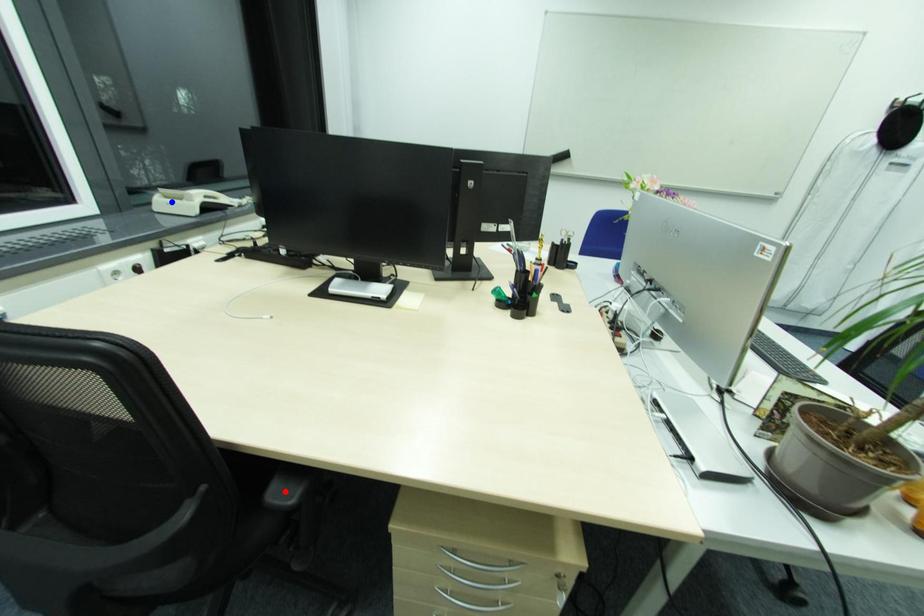
Question: Which of the two points in the image is closer to the camera?

Choices:
 (A) Blue point is closer.
 (B) Red point is closer.

Answer: (B)